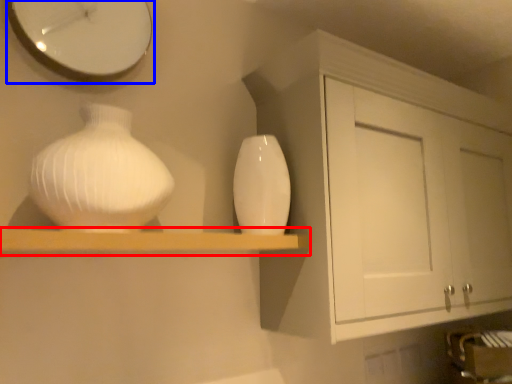
Question: Which of the following is the farthest to the observer, shelf (highlighted by a red box) or clock (highlighted by a blue box)?

Choices:
 (A) shelf
 (B) clock

Answer: (B)